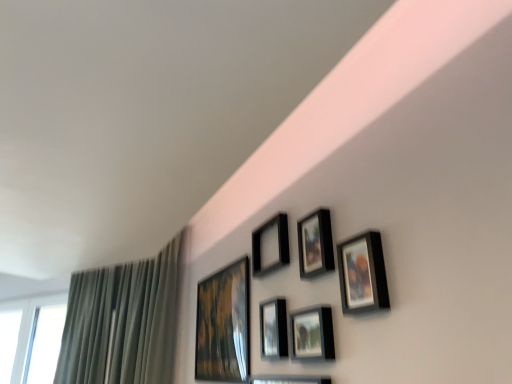
Question: Is matte black picture frame at upper center, acting as the second picture frame starting from the left, not within matte black picture frame at center, the 3th picture frame viewed from the left?

Choices:
 (A) no
 (B) yes

Answer: (B)

Question: Are matte black picture frame at upper center, acting as the second picture frame starting from the left, and matte black picture frame at center, the 3th picture frame viewed from the left, located far from each other?

Choices:
 (A) no
 (B) yes

Answer: (A)

Question: Considering the relative sizes of matte black picture frame at upper center, acting as the second picture frame starting from the left, and matte black picture frame at center, the fourth picture frame from the right, in the image provided, is matte black picture frame at upper center, acting as the second picture frame starting from the left, bigger than matte black picture frame at center, the fourth picture frame from the right,?

Choices:
 (A) no
 (B) yes

Answer: (B)

Question: Is matte black picture frame at upper center, which ranks as the fifth picture frame in right-to-left order, wider than matte black picture frame at center, the 3th picture frame viewed from the left?

Choices:
 (A) yes
 (B) no

Answer: (B)

Question: Is matte black picture frame at upper center, acting as the second picture frame starting from the left, touching matte black picture frame at center, the fourth picture frame from the right?

Choices:
 (A) yes
 (B) no

Answer: (B)

Question: Can you confirm if matte black picture frame at upper center, acting as the second picture frame starting from the left, is thinner than matte black picture frame at center, the 3th picture frame viewed from the left?

Choices:
 (A) yes
 (B) no

Answer: (A)

Question: Is matte gold painting at upper center, arranged as the 1th picture frame when viewed from the left, at the left side of matte black picture frame at upper center, arranged as the 2th picture frame when viewed from the right?

Choices:
 (A) no
 (B) yes

Answer: (B)

Question: Considering the relative sizes of matte gold painting at upper center, arranged as the 1th picture frame when viewed from the left, and matte black picture frame at upper center, arranged as the 2th picture frame when viewed from the right, in the image provided, is matte gold painting at upper center, arranged as the 1th picture frame when viewed from the left, wider than matte black picture frame at upper center, arranged as the 2th picture frame when viewed from the right,?

Choices:
 (A) yes
 (B) no

Answer: (A)

Question: Considering the relative sizes of matte gold painting at upper center, which is the sixth picture frame from right to left, and matte black picture frame at upper center, the 5th picture frame positioned from the left, in the image provided, is matte gold painting at upper center, which is the sixth picture frame from right to left, bigger than matte black picture frame at upper center, the 5th picture frame positioned from the left,?

Choices:
 (A) yes
 (B) no

Answer: (A)

Question: Does matte gold painting at upper center, which is the sixth picture frame from right to left, have a greater height compared to matte black picture frame at upper center, the 5th picture frame positioned from the left?

Choices:
 (A) yes
 (B) no

Answer: (A)

Question: Can you confirm if matte gold painting at upper center, arranged as the 1th picture frame when viewed from the left, is positioned to the right of matte black picture frame at upper center, the 5th picture frame positioned from the left?

Choices:
 (A) yes
 (B) no

Answer: (B)

Question: Is matte gold painting at upper center, which is the sixth picture frame from right to left, outside of matte black picture frame at upper center, the 5th picture frame positioned from the left?

Choices:
 (A) yes
 (B) no

Answer: (A)

Question: Does green fabric curtain at left have a lesser height compared to matte black picture frame at upper center, which ranks as the fifth picture frame in right-to-left order?

Choices:
 (A) no
 (B) yes

Answer: (A)